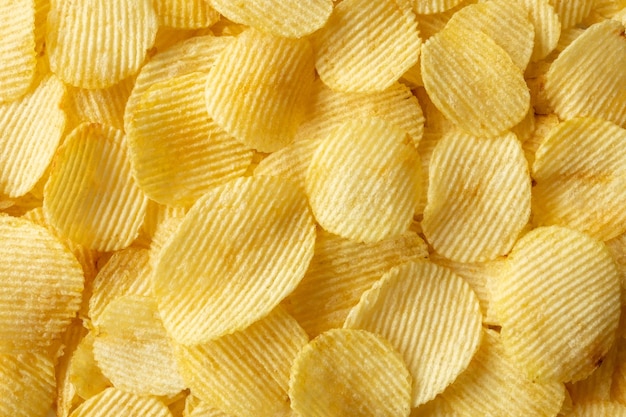
Find the location of a particular element. The width and height of the screenshot is (626, 417). light is located at coordinates (213, 316), (158, 362), (337, 189), (456, 353), (521, 186), (367, 69).